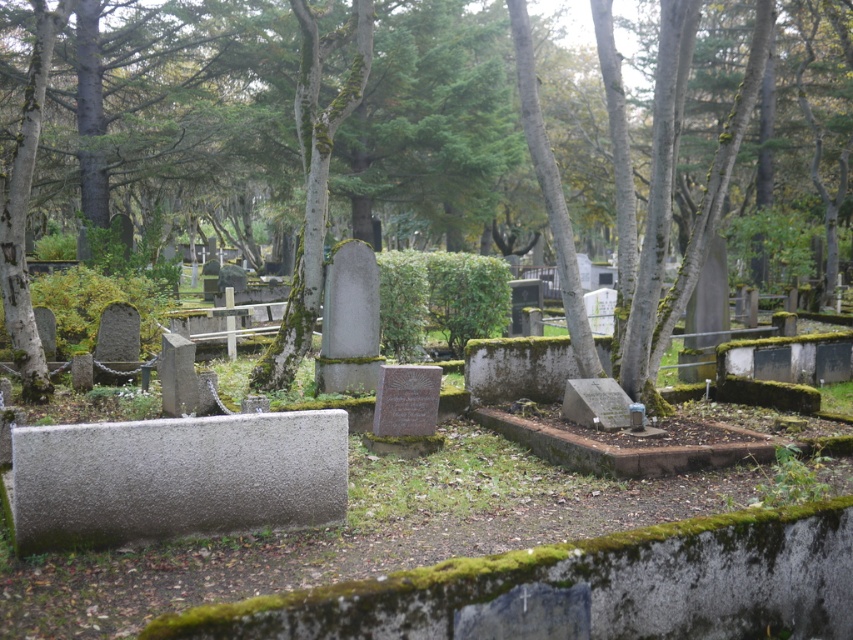
From the picture: You are a gardener tasked with trimming the green mossy tree at center. You need to reach the lowest branch of the tree. Is the granite tombstone at center in the way of your ladder placement?

The granite tombstone at center is located below the green mossy tree at center, so it is directly under the tree. This means the tombstone would block the placement of the ladder beneath the tree, making it impossible to place the ladder there safely.

You are standing in the cemetery and want to take a photo of the granite tombstone at center and the green mossy tree at center. Which object should you focus on first to ensure both are in clear view?

You should focus on the granite tombstone at center first since it is closer to you than the green mossy tree at center, ensuring both are in clear focus.